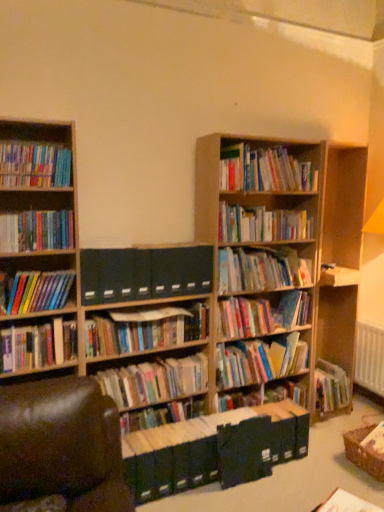
Question: From the image's perspective, is hardcover books at center, the ninth book in the top-to-bottom sequence, on top of brown leather swivel chair at lower left?

Choices:
 (A) no
 (B) yes

Answer: (B)

Question: Is hardcover books at center, the ninth book in the top-to-bottom sequence, to the left of brown leather swivel chair at lower left from the viewer's perspective?

Choices:
 (A) yes
 (B) no

Answer: (B)

Question: Considering the relative positions of hardcover books at center, acting as the 8th book starting from the bottom, and brown leather swivel chair at lower left in the image provided, is hardcover books at center, acting as the 8th book starting from the bottom, to the right of brown leather swivel chair at lower left from the viewer's perspective?

Choices:
 (A) no
 (B) yes

Answer: (B)

Question: Is the position of hardcover books at center, the ninth book in the top-to-bottom sequence, more distant than that of brown leather swivel chair at lower left?

Choices:
 (A) no
 (B) yes

Answer: (B)

Question: Is hardcover books at center, acting as the 8th book starting from the bottom, turned away from brown leather swivel chair at lower left?

Choices:
 (A) yes
 (B) no

Answer: (B)

Question: Is point (196, 466) positioned closer to the camera than point (137, 340)?

Choices:
 (A) farther
 (B) closer

Answer: (B)

Question: In the image, is green matte file folders at center, the sixteenth book viewed from the top, positioned in front of or behind hardcover books at center, which is the 7th book in bottom-to-top order?

Choices:
 (A) front
 (B) behind

Answer: (A)

Question: Considering the positions of green matte file folders at center, the sixteenth book viewed from the top, and hardcover books at center, which is the 7th book in bottom-to-top order, in the image, is green matte file folders at center, the sixteenth book viewed from the top, wider or thinner than hardcover books at center, which is the 7th book in bottom-to-top order,?

Choices:
 (A) thin
 (B) wide

Answer: (B)

Question: Would you say green matte file folders at center, the sixteenth book viewed from the top, is to the left or to the right of hardcover books at center, the 10th book viewed from the top, in the picture?

Choices:
 (A) left
 (B) right

Answer: (B)

Question: Visually, is hardcover books at left, the 11th book positioned from the top, positioned to the left or to the right of brown leather swivel chair at lower left?

Choices:
 (A) left
 (B) right

Answer: (A)

Question: Considering the positions of hardcover books at left, the 6th book when ordered from bottom to top, and brown leather swivel chair at lower left in the image, is hardcover books at left, the 6th book when ordered from bottom to top, taller or shorter than brown leather swivel chair at lower left?

Choices:
 (A) short
 (B) tall

Answer: (A)

Question: Is hardcover books at left, the 6th book when ordered from bottom to top, situated inside brown leather swivel chair at lower left or outside?

Choices:
 (A) inside
 (B) outside

Answer: (B)

Question: From the image's perspective, relative to brown leather swivel chair at lower left, is hardcover books at left, the 6th book when ordered from bottom to top, above or below?

Choices:
 (A) below
 (B) above

Answer: (B)

Question: Is hardcover books at center, the 2th book in the bottom-to-top sequence, situated inside hardcover books at center, which is the 7th book in bottom-to-top order, or outside?

Choices:
 (A) outside
 (B) inside

Answer: (A)

Question: From a real-world perspective, is hardcover books at center, the 2th book in the bottom-to-top sequence, physically located above or below hardcover books at center, the 10th book viewed from the top?

Choices:
 (A) below
 (B) above

Answer: (A)